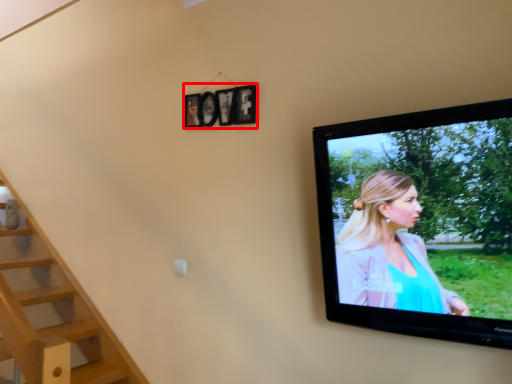
Question: From the image's perspective, what is the correct spatial relationship of picture frame (annotated by the red box) in relation to television?

Choices:
 (A) below
 (B) above

Answer: (B)